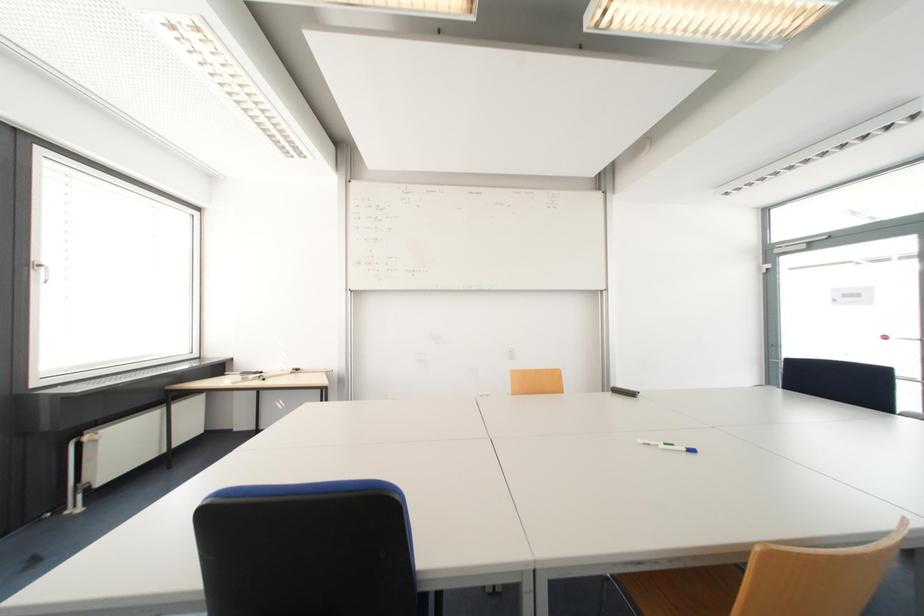
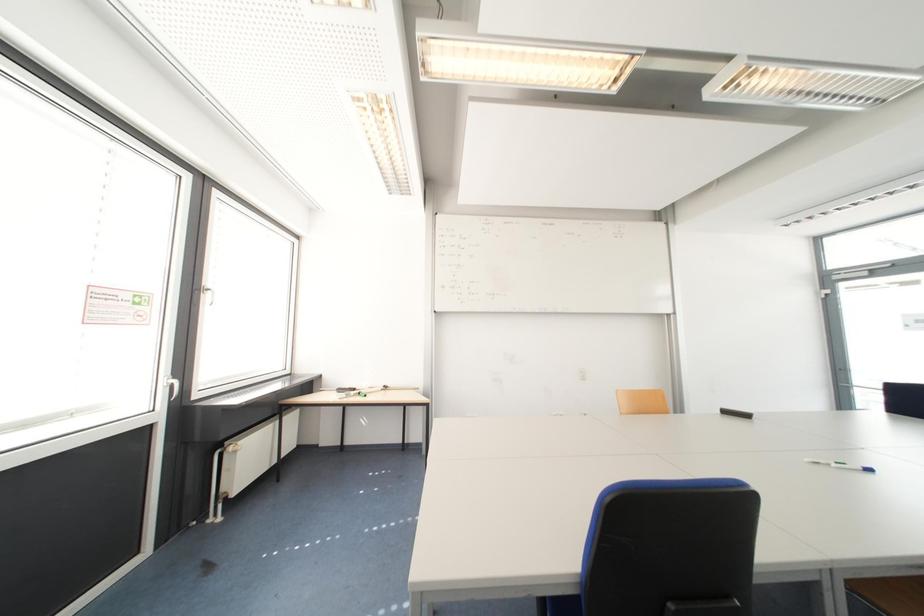
Question: What movement of the cameraman would produce the second image?

Choices:
 (A) Left
 (B) Right
 (C) Forward
 (D) Backward

Answer: (A)